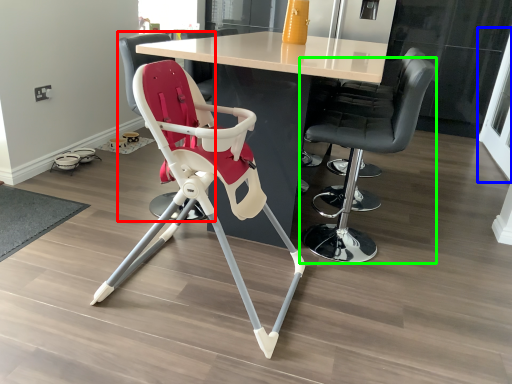
Question: Estimate the real-world distances between objects in this image. Which object is farther from chair (highlighted by a red box), screen door (highlighted by a blue box) or chair (highlighted by a green box)?

Choices:
 (A) screen door
 (B) chair

Answer: (A)